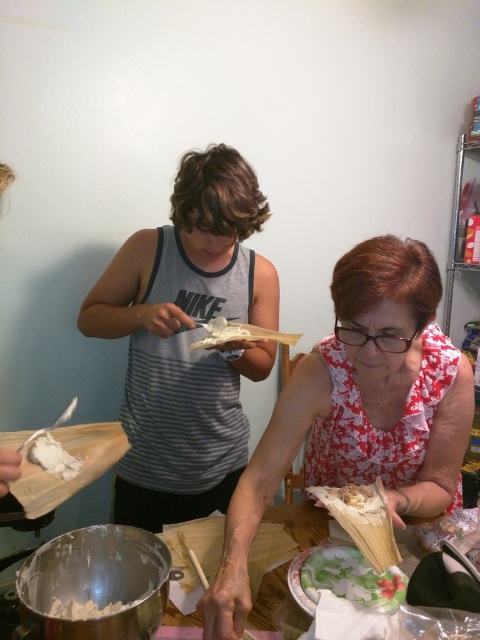
You are a chef preparing tamales and notice the gray striped tank top at center and the white fluffy dough at lower left on the table. Which item is closer to you as you face the table?

The gray striped tank top at center is closer to you because the white fluffy dough at lower left is behind it.